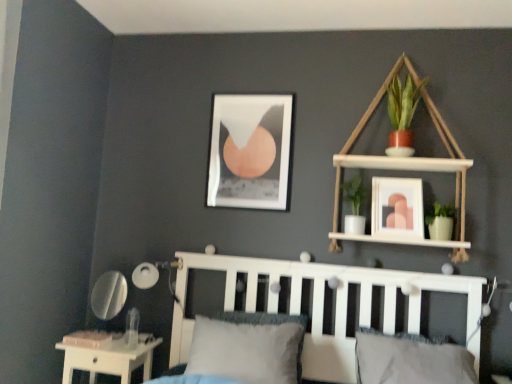
Question: From the image's perspective, is white glossy table at lower left under white wood bookshelf at upper right?

Choices:
 (A) yes
 (B) no

Answer: (A)

Question: Is white glossy table at lower left oriented towards white wood bookshelf at upper right?

Choices:
 (A) yes
 (B) no

Answer: (B)

Question: Is white glossy table at lower left looking in the opposite direction of white wood bookshelf at upper right?

Choices:
 (A) yes
 (B) no

Answer: (B)

Question: From the image's perspective, does white glossy table at lower left appear higher than white wood bookshelf at upper right?

Choices:
 (A) yes
 (B) no

Answer: (B)

Question: Considering the relative sizes of white glossy table at lower left and white wood bookshelf at upper right in the image provided, is white glossy table at lower left shorter than white wood bookshelf at upper right?

Choices:
 (A) yes
 (B) no

Answer: (A)

Question: Can we say white glossy table at lower left lies outside white wood bookshelf at upper right?

Choices:
 (A) yes
 (B) no

Answer: (A)

Question: Could you tell me if gray textured pillow at center, which appears as the first pillow when viewed from the left, is facing matte black picture frame at upper center, the second picture frame positioned from the front?

Choices:
 (A) no
 (B) yes

Answer: (A)

Question: Is gray textured pillow at center, the 2th pillow from the right, completely or partially outside of matte black picture frame at upper center, arranged as the first picture frame when viewed from the left?

Choices:
 (A) no
 (B) yes

Answer: (B)

Question: Considering the relative positions of gray textured pillow at center, the 2th pillow from the right, and matte black picture frame at upper center, which ranks as the second picture frame in right-to-left order, in the image provided, is gray textured pillow at center, the 2th pillow from the right, behind matte black picture frame at upper center, which ranks as the second picture frame in right-to-left order,?

Choices:
 (A) yes
 (B) no

Answer: (B)

Question: Is matte black picture frame at upper center, acting as the 1th picture frame starting from the back, surrounded by gray textured pillow at center, the 2th pillow from the right?

Choices:
 (A) no
 (B) yes

Answer: (A)

Question: Is gray textured pillow at center, which appears as the first pillow when viewed from the left, wider than matte black picture frame at upper center, the second picture frame positioned from the front?

Choices:
 (A) yes
 (B) no

Answer: (A)

Question: Can you confirm if gray textured pillow at center, the 2th pillow from the right, is taller than matte black picture frame at upper center, the second picture frame positioned from the front?

Choices:
 (A) yes
 (B) no

Answer: (B)

Question: Is white wood bookshelf at upper right looking in the opposite direction of white wooden bed frame at center?

Choices:
 (A) no
 (B) yes

Answer: (A)